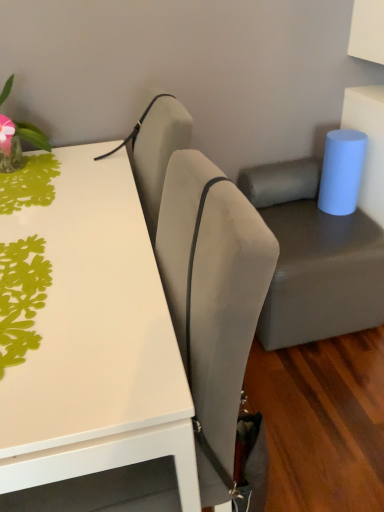
The width and height of the screenshot is (384, 512). What do you see at coordinates (18, 142) in the screenshot?
I see `green matte vase at upper left, arranged as the first plant when viewed from the back` at bounding box center [18, 142].

The width and height of the screenshot is (384, 512). What are the coordinates of `matte gray swivel chair at center` in the screenshot? It's located at (314, 258).

The width and height of the screenshot is (384, 512). Describe the element at coordinates (314, 258) in the screenshot. I see `matte gray swivel chair at center` at that location.

Measure the distance between point (186,121) and camera.

They are 1.11 meters apart.

Locate an element on the screen. Image resolution: width=384 pixels, height=512 pixels. green matte vase at upper left, the 1th plant when ordered from top to bottom is located at coordinates coord(18,142).

Is white glossy table at upper left inside matte gray swivel chair at center?

No, white glossy table at upper left is not a part of matte gray swivel chair at center.

Where is `table in front of the matte gray swivel chair at center`? table in front of the matte gray swivel chair at center is located at coordinates tap(95, 340).

Can you confirm if matte gray swivel chair at center is smaller than white glossy table at upper left?

Indeed, matte gray swivel chair at center has a smaller size compared to white glossy table at upper left.

Is green paper cutout at upper left, the first plant when ordered from bottom to top, next to suede-like beige chair at center?

green paper cutout at upper left, the first plant when ordered from bottom to top, and suede-like beige chair at center are clearly separated.

In terms of height, does green paper cutout at upper left, marked as the 2th plant in a back-to-front arrangement, look taller or shorter compared to suede-like beige chair at center?

Considering their sizes, green paper cutout at upper left, marked as the 2th plant in a back-to-front arrangement, has less height than suede-like beige chair at center.

Consider the image. Is suede-like beige chair at center a part of green paper cutout at upper left, the second plant from the top?

No, suede-like beige chair at center is not a part of green paper cutout at upper left, the second plant from the top.

Locate an element on the screen. The image size is (384, 512). chair in front of the green paper cutout at upper left, marked as the 2th plant in a back-to-front arrangement is located at coordinates (212, 298).

Do you think white glossy table at upper left is within matte gray swivel chair at center, or outside of it?

white glossy table at upper left is spatially situated outside matte gray swivel chair at center.

From the image's perspective, is white glossy table at upper left positioned above or below matte gray swivel chair at center?

From the image's perspective, white glossy table at upper left appears below matte gray swivel chair at center.

Is point (129, 386) closer or farther from the camera than point (279, 222)?

Point (129, 386) appears to be closer to the viewer than point (279, 222).

Considering the relative sizes of matte gray swivel chair at center and suede-like beige chair at center in the image provided, is matte gray swivel chair at center smaller than suede-like beige chair at center?

Incorrect, matte gray swivel chair at center is not smaller in size than suede-like beige chair at center.

Is matte gray swivel chair at center wider or thinner than suede-like beige chair at center?

matte gray swivel chair at center is wider than suede-like beige chair at center.

Can you confirm if matte gray swivel chair at center is positioned to the left of suede-like beige chair at center?

In fact, matte gray swivel chair at center is to the right of suede-like beige chair at center.

Considering the sizes of objects green paper cutout at upper left, the second plant from the top, and matte gray swivel chair at center in the image provided, who is bigger, green paper cutout at upper left, the second plant from the top, or matte gray swivel chair at center?

Bigger between the two is matte gray swivel chair at center.

Considering the positions of objects green paper cutout at upper left, the first plant when ordered from bottom to top, and matte gray swivel chair at center in the image provided, who is more to the left, green paper cutout at upper left, the first plant when ordered from bottom to top, or matte gray swivel chair at center?

From the viewer's perspective, green paper cutout at upper left, the first plant when ordered from bottom to top, appears more on the left side.

Considering the relative positions of green paper cutout at upper left, the first plant when ordered from bottom to top, and matte gray swivel chair at center in the image provided, is green paper cutout at upper left, the first plant when ordered from bottom to top, behind matte gray swivel chair at center?

No, it is in front of matte gray swivel chair at center.

How many degrees apart are the facing directions of green paper cutout at upper left, marked as the 2th plant in a back-to-front arrangement, and matte gray swivel chair at center?

0.000162 degrees separate the facing orientations of green paper cutout at upper left, marked as the 2th plant in a back-to-front arrangement, and matte gray swivel chair at center.

Is suede-like beige armchair at upper center far away from white glossy table at upper left?

That's not correct — suede-like beige armchair at upper center is a little close to white glossy table at upper left.

Between suede-like beige armchair at upper center and white glossy table at upper left, which one has smaller size?

suede-like beige armchair at upper center.

Is suede-like beige armchair at upper center situated inside white glossy table at upper left or outside?

suede-like beige armchair at upper center is not enclosed by white glossy table at upper left.

Is suede-like beige armchair at upper center aimed at white glossy table at upper left?

Yes, suede-like beige armchair at upper center is aimed at white glossy table at upper left.

Can you tell me how much suede-like beige chair at center and green paper cutout at upper left, marked as the 2th plant in a back-to-front arrangement, differ in facing direction?

They differ by 20.2 degrees in their facing directions.

Does suede-like beige chair at center have a greater width compared to green paper cutout at upper left, acting as the first plant starting from the front?

No.

Considering the relative positions of suede-like beige chair at center and green paper cutout at upper left, acting as the first plant starting from the front, in the image provided, is suede-like beige chair at center to the left of green paper cutout at upper left, acting as the first plant starting from the front, from the viewer's perspective?

No, suede-like beige chair at center is not to the left of green paper cutout at upper left, acting as the first plant starting from the front.

Is suede-like beige chair at center completely or partially outside of green paper cutout at upper left, acting as the first plant starting from the front?

Indeed, suede-like beige chair at center is completely outside green paper cutout at upper left, acting as the first plant starting from the front.

Image resolution: width=384 pixels, height=512 pixels. Identify the location of table lying on the left of matte gray swivel chair at center. (95, 340).

Locate an element on the screen. Image resolution: width=384 pixels, height=512 pixels. chair directly beneath the green paper cutout at upper left, the first plant when ordered from bottom to top (from a real-world perspective) is located at coordinates (212, 298).

Based on their spatial positions, is white glossy table at upper left or suede-like beige chair at center further from suede-like beige armchair at upper center?

suede-like beige chair at center lies further to suede-like beige armchair at upper center than the other object.

Estimate the real-world distances between objects in this image. Which object is closer to white glossy table at upper left, suede-like beige armchair at upper center or green paper cutout at upper left, marked as the 2th plant in a back-to-front arrangement?

Based on the image, green paper cutout at upper left, marked as the 2th plant in a back-to-front arrangement, appears to be nearer to white glossy table at upper left.

Which object lies further to the anchor point green matte vase at upper left, which ranks as the 2th plant in bottom-to-top order, green paper cutout at upper left, the first plant when ordered from bottom to top, or suede-like beige chair at center?

suede-like beige chair at center is positioned further to the anchor green matte vase at upper left, which ranks as the 2th plant in bottom-to-top order.

Looking at the image, which one is located closer to green matte vase at upper left, the second plant from the front, green paper cutout at upper left, the first plant when ordered from bottom to top, or suede-like beige armchair at upper center?

Among the two, suede-like beige armchair at upper center is located nearer to green matte vase at upper left, the second plant from the front.

Considering their positions, is green paper cutout at upper left, the second plant from the top, positioned further to suede-like beige chair at center than suede-like beige armchair at upper center?

suede-like beige armchair at upper center is positioned further to the anchor suede-like beige chair at center.

From the image, which object appears to be farther from matte gray swivel chair at center, suede-like beige armchair at upper center or suede-like beige chair at center?

suede-like beige chair at center is positioned further to the anchor matte gray swivel chair at center.

From the image, which object appears to be nearer to green matte vase at upper left, the second plant from the front, matte gray swivel chair at center or white glossy table at upper left?

white glossy table at upper left is positioned closer to the anchor green matte vase at upper left, the second plant from the front.

From the image, which object appears to be nearer to suede-like beige chair at center, suede-like beige armchair at upper center or green paper cutout at upper left, the first plant when ordered from bottom to top?

Based on the image, green paper cutout at upper left, the first plant when ordered from bottom to top, appears to be nearer to suede-like beige chair at center.

Identify the location of plant between green matte vase at upper left, which ranks as the 2th plant in bottom-to-top order, and matte gray swivel chair at center. The width and height of the screenshot is (384, 512). (21, 297).

Where is `armchair between green matte vase at upper left, the second plant from the front, and matte gray swivel chair at center, in the horizontal direction`? armchair between green matte vase at upper left, the second plant from the front, and matte gray swivel chair at center, in the horizontal direction is located at coordinates (156, 150).

The height and width of the screenshot is (512, 384). In order to click on table situated between green paper cutout at upper left, the first plant when ordered from bottom to top, and suede-like beige chair at center from left to right in this screenshot , I will do `click(95, 340)`.

I want to click on plant positioned between green paper cutout at upper left, the first plant when ordered from bottom to top, and suede-like beige armchair at upper center from near to far, so click(x=18, y=142).